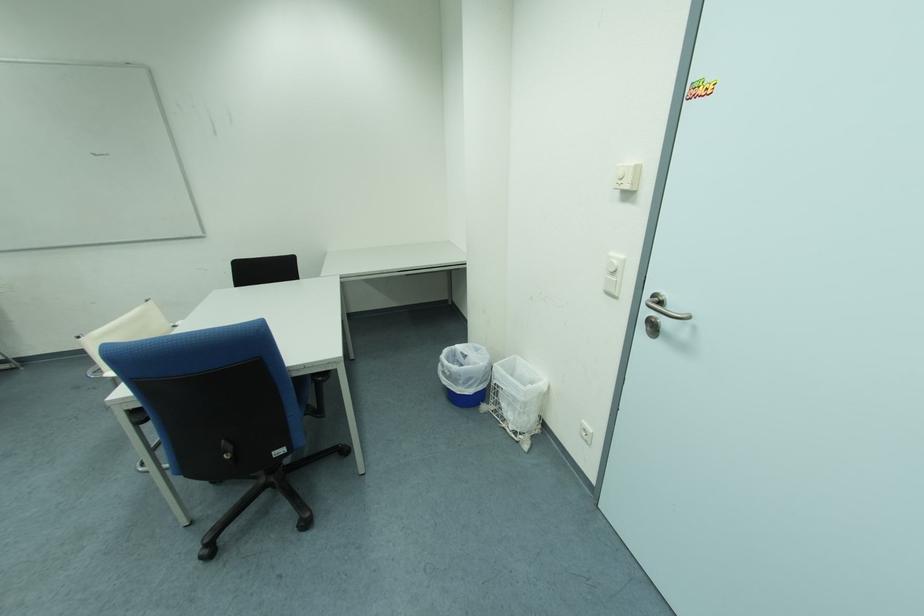
Identify the location of wire trash can. The width and height of the screenshot is (924, 616). (465, 373).